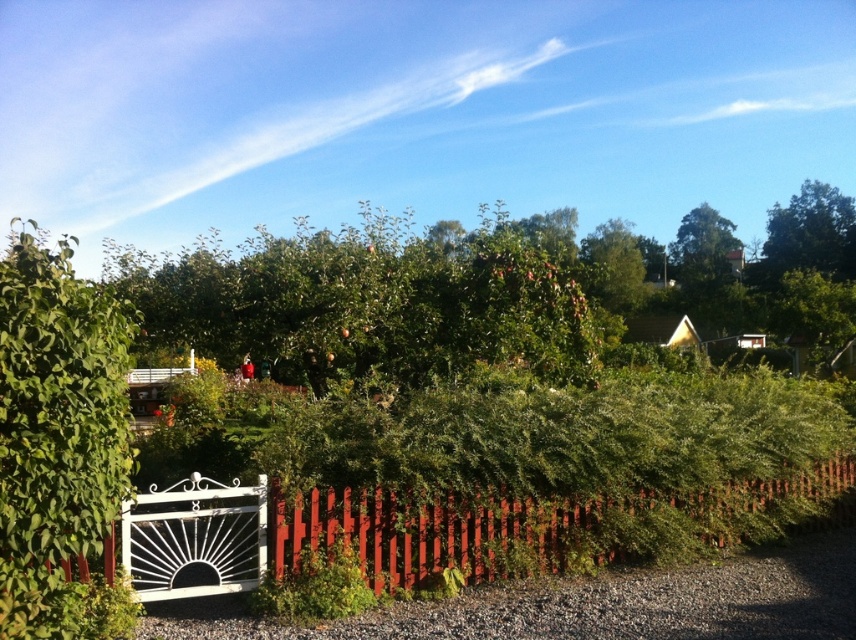
Can you confirm if green leafy tree at center is shorter than red wooden fence at lower center?

In fact, green leafy tree at center may be taller than red wooden fence at lower center.

Does green leafy tree at center have a greater width compared to red wooden fence at lower center?

Yes.

Identify the location of green leafy tree at center. (367, 301).

You are a GUI agent. You are given a task and a screenshot of the screen. Output one action in this format:
    pyautogui.click(x=<x>, y=<y>)
    Task: Click on the green leafy tree at center
    
    Given the screenshot: What is the action you would take?
    pyautogui.click(x=367, y=301)

Can you confirm if green leafy tree at center is thinner than green leafy bush at center?

In fact, green leafy tree at center might be wider than green leafy bush at center.

Which is in front, point (415, 332) or point (122, 417)?

Positioned in front is point (122, 417).

In order to click on green leafy tree at center in this screenshot , I will do `click(367, 301)`.

Is green leafy bush at center thinner than red wooden fence at lower center?

Indeed, green leafy bush at center has a lesser width compared to red wooden fence at lower center.

Describe the element at coordinates (58, 442) in the screenshot. I see `green leafy bush at center` at that location.

Does point (25, 509) come behind point (302, 538)?

That is False.

Image resolution: width=856 pixels, height=640 pixels. Identify the location of green leafy bush at center. (58, 442).